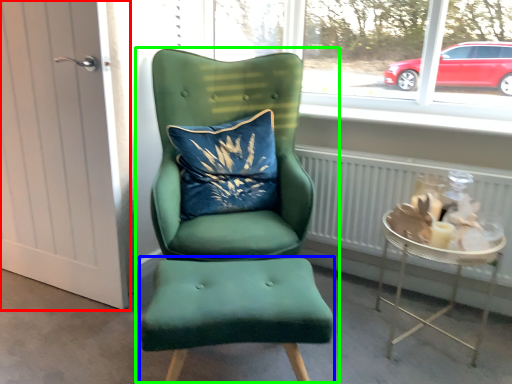
Question: Which is farther away from door (highlighted by a red box)? stool (highlighted by a blue box) or chair (highlighted by a green box)?

Choices:
 (A) stool
 (B) chair

Answer: (A)